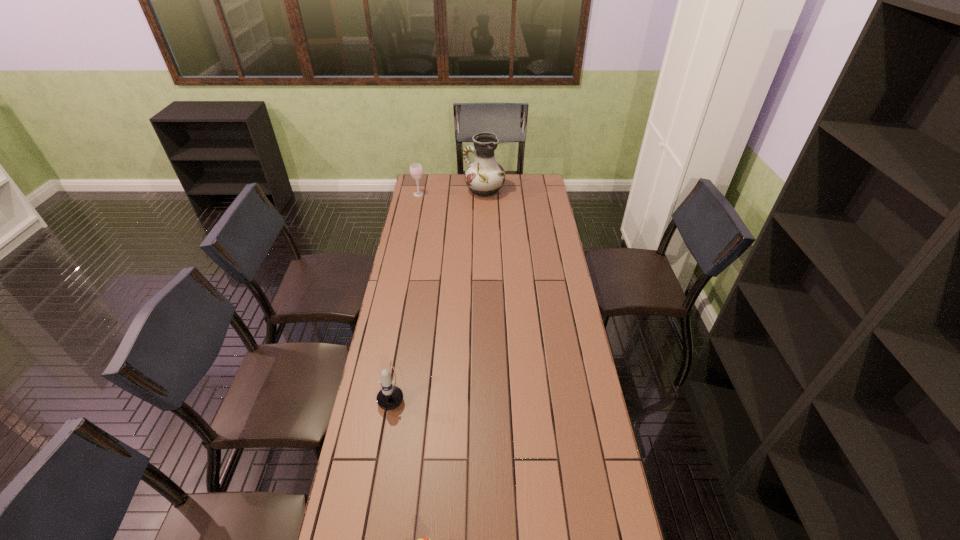
Image resolution: width=960 pixels, height=540 pixels. In order to click on microphone that is at the left edge in this screenshot , I will do `click(390, 397)`.

Locate an element on the screen. The image size is (960, 540). object that is at the far left corner is located at coordinates 416,170.

Find the location of a particular element. free region at the left edge of the desktop is located at coordinates (418, 238).

Where is `free location at the right edge of the desktop`? Image resolution: width=960 pixels, height=540 pixels. free location at the right edge of the desktop is located at coordinates (560, 422).

Where is `unoccupied area between the wineglass and the third farthest object`? This screenshot has height=540, width=960. unoccupied area between the wineglass and the third farthest object is located at coordinates (406, 290).

Where is `free space between the wineglass and the vase`? The width and height of the screenshot is (960, 540). free space between the wineglass and the vase is located at coordinates (451, 192).

In order to click on unoccupied area between the wineglass and the vase in this screenshot , I will do `click(451, 192)`.

Find the location of a particular element. free spot between the wineglass and the microphone is located at coordinates (406, 290).

Locate which object ranks third in proximity to the tallest object. Please provide its 2D coordinates. Your answer should be formatted as a tuple, i.e. [(x, y)], where the tuple contains the x and y coordinates of a point satisfying the conditions above.

[(425, 539)]

The height and width of the screenshot is (540, 960). In order to click on object identified as the third closest to the tallest object in this screenshot , I will do `click(425, 539)`.